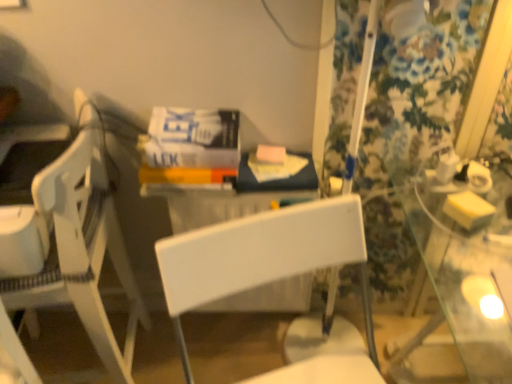
Question: Looking at the image, does white plastic chair at center, placed as the 1th chair when sorted from right to left, seem bigger or smaller compared to white plastic chair at left, the 1th chair from the left?

Choices:
 (A) big
 (B) small

Answer: (B)

Question: From the image's perspective, is white plastic chair at center, the 2th chair viewed from the left, located above or below white plastic chair at left, which is the second chair in right-to-left order?

Choices:
 (A) below
 (B) above

Answer: (A)

Question: Considering the real-world distances, which object is closest to the white plastic chair at center, placed as the 1th chair when sorted from right to left?

Choices:
 (A) floral fabric curtain at right
 (B) white plastic chair at left, which is the second chair in right-to-left order

Answer: (B)

Question: Estimate the real-world distances between objects in this image. Which object is closer to the floral fabric curtain at right?

Choices:
 (A) white plastic chair at left, which is the second chair in right-to-left order
 (B) white plastic chair at center, placed as the 1th chair when sorted from right to left

Answer: (B)